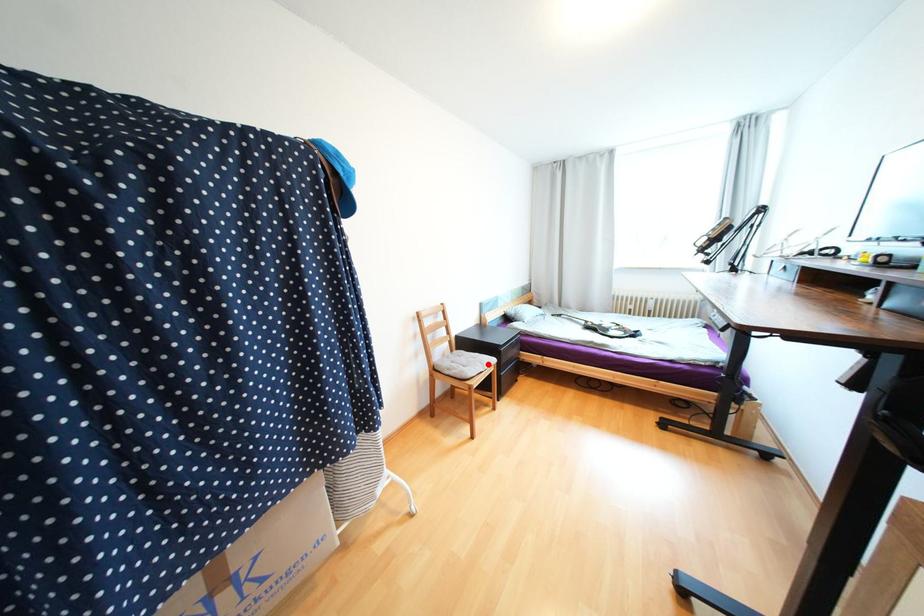
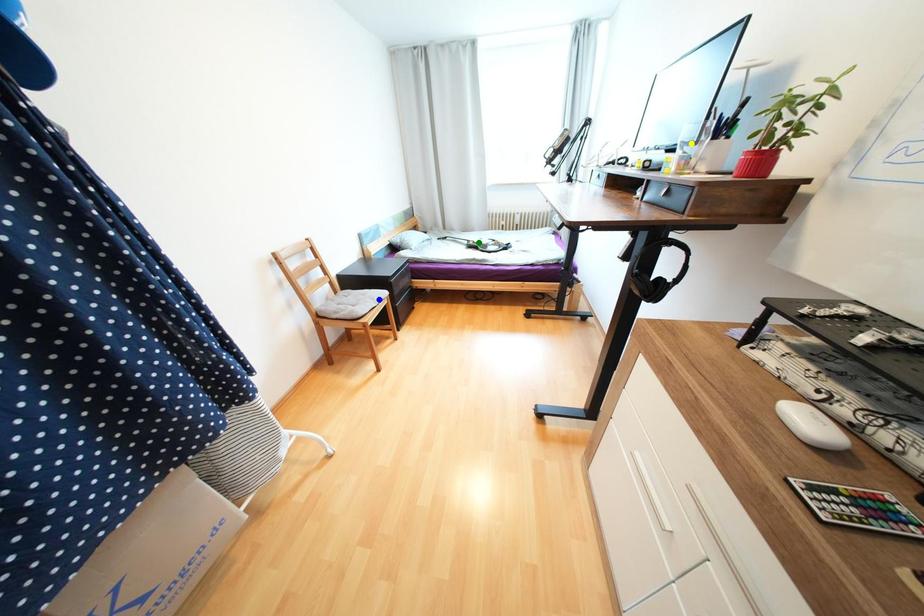
Question: I am providing you with two images of the same scene from different viewpoints. A red point is marked on the first image. You are given multiple points on the second image. Which spot in image 2 lines up with the point in image 1?

Choices:
 (A) blue point
 (B) green point
 (C) yellow point

Answer: (A)